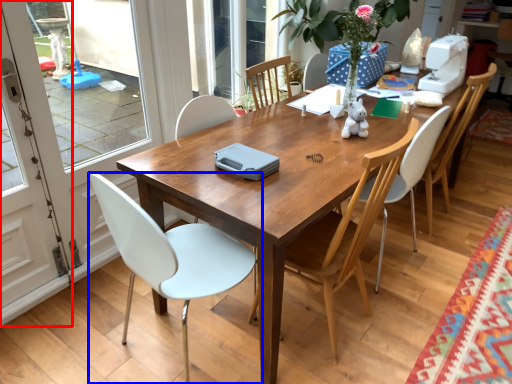
Question: Which point is closer to the camera, screen door (highlighted by a red box) or chair (highlighted by a blue box)?

Choices:
 (A) screen door
 (B) chair

Answer: (B)